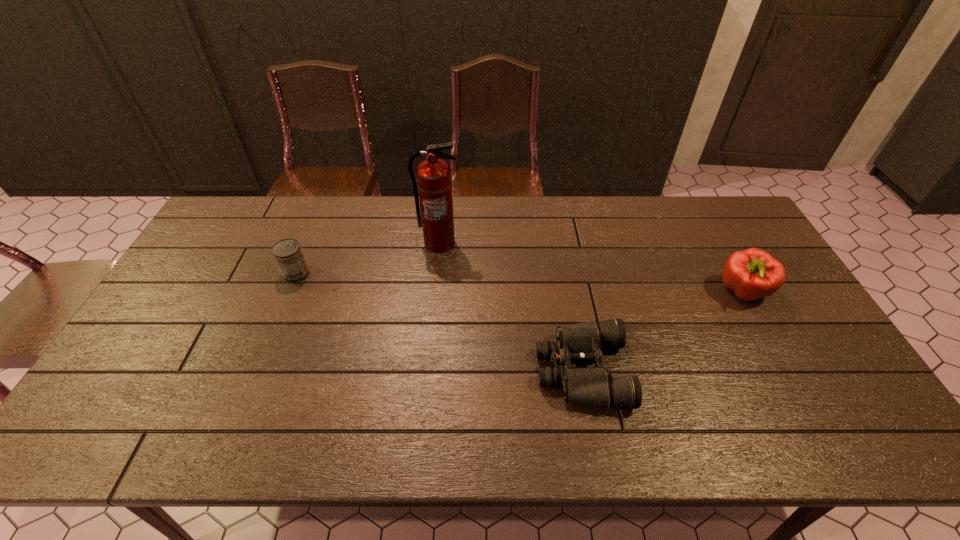
Where is `free point located on the left of the third tallest object`? free point located on the left of the third tallest object is located at coordinates (193, 273).

In order to click on blank area located through the eyepieces of the binoculars in this screenshot , I will do `click(497, 370)`.

At what (x,y) coordinates should I click in order to perform the action: click on vacant area located through the eyepieces of the binoculars. Please return your answer as a coordinate pair (x, y). Looking at the image, I should click on (486, 370).

Identify the location of vacant region located 0.100m through the eyepieces of the binoculars. (497, 370).

Locate an element on the screen. This screenshot has height=540, width=960. object that is at the far edge is located at coordinates (434, 182).

Where is `object that is positioned at the near edge`? object that is positioned at the near edge is located at coordinates (579, 342).

Where is `object that is at the right edge`? The width and height of the screenshot is (960, 540). object that is at the right edge is located at coordinates (753, 273).

The width and height of the screenshot is (960, 540). In order to click on vacant space at the far edge of the desktop in this screenshot , I will do `click(587, 226)`.

At what (x,y) coordinates should I click in order to perform the action: click on vacant space at the near edge of the desktop. Please return your answer as a coordinate pair (x, y). Image resolution: width=960 pixels, height=540 pixels. Looking at the image, I should click on (386, 428).

This screenshot has height=540, width=960. Find the location of `blank space at the right edge of the desktop`. blank space at the right edge of the desktop is located at coordinates (844, 403).